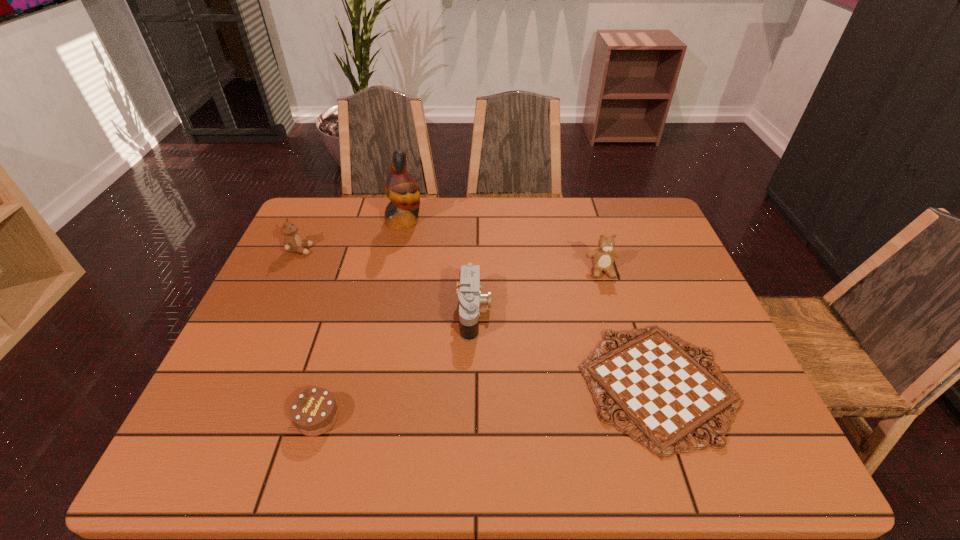
Select which object appears as the fifth closest to the shortest object. Please provide its 2D coordinates. Your answer should be formatted as a tuple, i.e. [(x, y)], where the tuple contains the x and y coordinates of a point satisfying the conditions above.

[(292, 242)]

Locate an element on the screen. This screenshot has width=960, height=540. vacant point that satisfies the following two spatial constraints: 1. on the front-facing side of the third farthest object; 2. on the right side of the shortest object is located at coordinates (636, 384).

At what (x,y) coordinates should I click in order to perform the action: click on vacant area in the image that satisfies the following two spatial constraints: 1. on the front-facing side of the right teddy bear; 2. on the lens of the third object from right to left. Please return your answer as a coordinate pair (x, y). Image resolution: width=960 pixels, height=540 pixels. Looking at the image, I should click on (614, 312).

This screenshot has height=540, width=960. Identify the location of vacant area in the image that satisfies the following two spatial constraints: 1. on the front-facing side of the right teddy bear; 2. on the lens of the fourth tallest object. (614, 312).

Locate an element on the screen. vacant region that satisfies the following two spatial constraints: 1. on the front-facing side of the fifth tallest object; 2. on the left side of the second farthest object is located at coordinates (223, 417).

Image resolution: width=960 pixels, height=540 pixels. In order to click on blank area in the image that satisfies the following two spatial constraints: 1. on the lens of the fourth object from left to right; 2. on the left side of the shortest object in this screenshot , I will do `click(473, 384)`.

Where is `free space that satisfies the following two spatial constraints: 1. on the front-facing side of the right teddy bear; 2. on the lens of the camera`? This screenshot has height=540, width=960. free space that satisfies the following two spatial constraints: 1. on the front-facing side of the right teddy bear; 2. on the lens of the camera is located at coordinates (614, 312).